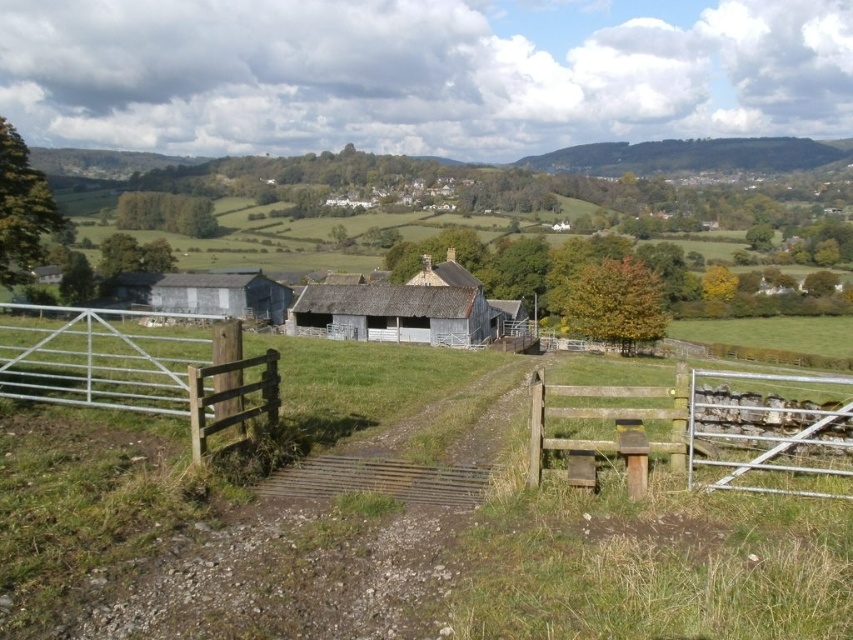
Question: Which point is closer to the camera?

Choices:
 (A) weathered gray barn at left
 (B) green grassy at center
 (C) weathered wood barn at center

Answer: (B)

Question: Can you confirm if green grassy at center is bigger than weathered wood barn at center?

Choices:
 (A) no
 (B) yes

Answer: (A)

Question: Which object appears farthest from the camera in this image?

Choices:
 (A) metallic silver gate at left
 (B) brown wooden fence at lower right
 (C) weathered gray barn at left
 (D) weathered wood barn at center

Answer: (C)

Question: Is metallic silver gate at left further to the viewer compared to weathered wood barn at center?

Choices:
 (A) yes
 (B) no

Answer: (B)

Question: Does brown wooden fence at lower right appear on the left side of weathered gray barn at left?

Choices:
 (A) yes
 (B) no

Answer: (B)

Question: Which of these objects is positioned farthest from the green grassy at center?

Choices:
 (A) weathered gray barn at left
 (B) brown wooden fence at lower right

Answer: (A)